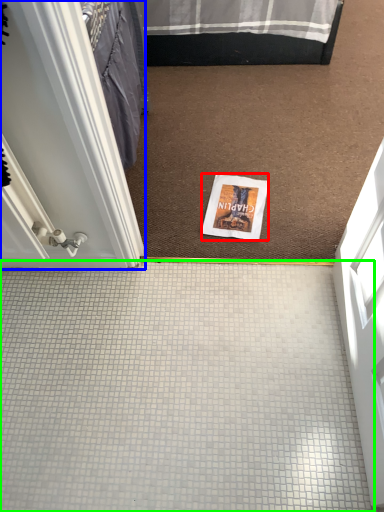
Question: Which is farther away from magazine (highlighted by a red box)? door (highlighted by a blue box) or plain (highlighted by a green box)?

Choices:
 (A) door
 (B) plain

Answer: (A)